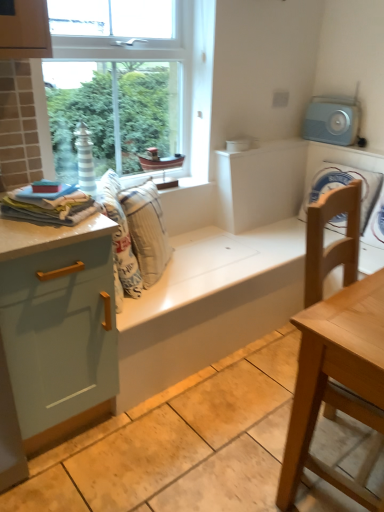
Question: Considering the relative sizes of soft cotton towels at left, arranged as the 2th material when viewed from the back, and white fabric washing machine at right in the image provided, is soft cotton towels at left, arranged as the 2th material when viewed from the back, taller than white fabric washing machine at right?

Choices:
 (A) no
 (B) yes

Answer: (A)

Question: Is soft cotton towels at left, the 1th material positioned from the front, with white fabric washing machine at right?

Choices:
 (A) yes
 (B) no

Answer: (B)

Question: Can you confirm if soft cotton towels at left, arranged as the 2th material when viewed from the back, is positioned to the right of white fabric washing machine at right?

Choices:
 (A) yes
 (B) no

Answer: (B)

Question: Does soft cotton towels at left, arranged as the 2th material when viewed from the back, come behind white fabric washing machine at right?

Choices:
 (A) yes
 (B) no

Answer: (B)

Question: Is soft cotton towels at left, the 1th material positioned from the front, oriented towards white fabric washing machine at right?

Choices:
 (A) yes
 (B) no

Answer: (B)

Question: Can you confirm if soft cotton towels at left, the 1th material positioned from the front, is thinner than white fabric washing machine at right?

Choices:
 (A) no
 (B) yes

Answer: (A)

Question: Does white fabric washing machine at right come in front of beige fabric cushion at center, which is the first material in back-to-front order?

Choices:
 (A) no
 (B) yes

Answer: (A)

Question: Is white fabric washing machine at right smaller than beige fabric cushion at center, which ranks as the 1th material in right-to-left order?

Choices:
 (A) no
 (B) yes

Answer: (B)

Question: Is white fabric washing machine at right further to the viewer compared to beige fabric cushion at center, marked as the second material in a front-to-back arrangement?

Choices:
 (A) yes
 (B) no

Answer: (A)

Question: Is white fabric washing machine at right taller than beige fabric cushion at center, which is the first material in back-to-front order?

Choices:
 (A) no
 (B) yes

Answer: (A)

Question: Is white fabric washing machine at right bigger than beige fabric cushion at center, which is the second material from left to right?

Choices:
 (A) no
 (B) yes

Answer: (A)

Question: Does white fabric washing machine at right appear on the right side of beige fabric cushion at center, which is the first material in back-to-front order?

Choices:
 (A) no
 (B) yes

Answer: (B)

Question: From the image's perspective, is light wood table at right on top of light blue glossy cabinet at left?

Choices:
 (A) no
 (B) yes

Answer: (A)